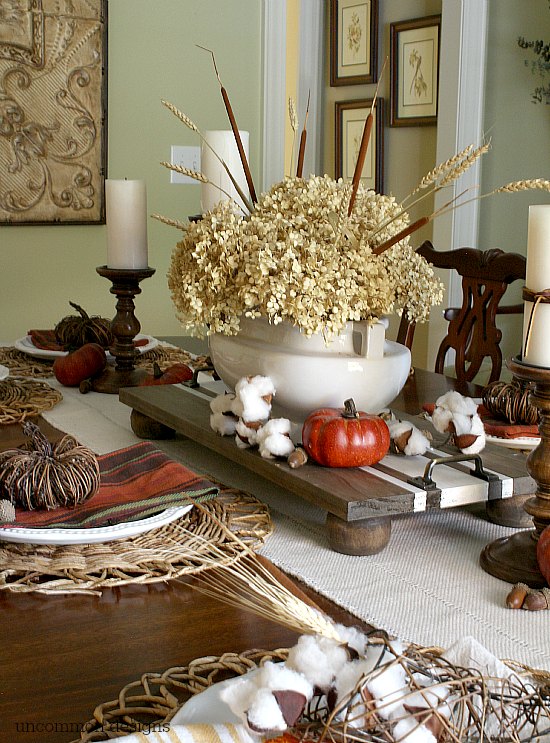
This screenshot has width=550, height=743. I want to click on tan runner, so click(424, 588).